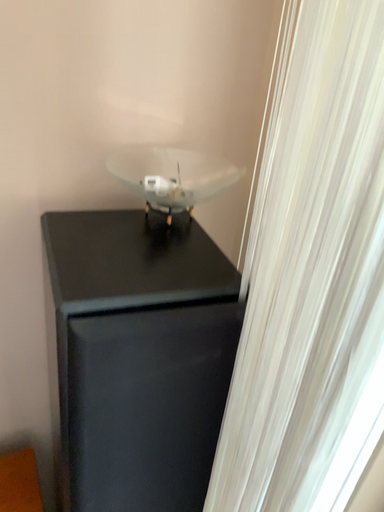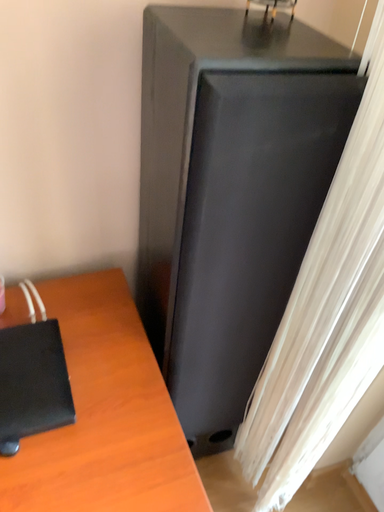
Question: How did the camera likely rotate when shooting the video?

Choices:
 (A) rotated upward
 (B) rotated downward

Answer: (B)